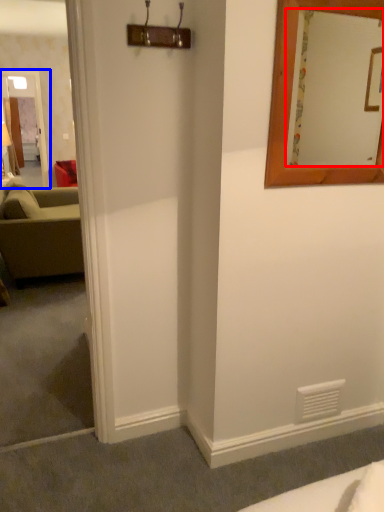
Question: Which object is closer to the camera taking this photo, mirror (highlighted by a red box) or glass door (highlighted by a blue box)?

Choices:
 (A) mirror
 (B) glass door

Answer: (A)